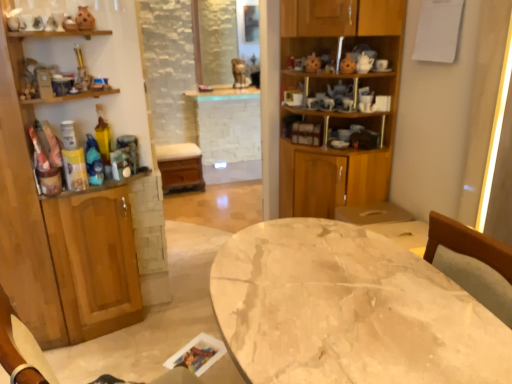
This screenshot has width=512, height=384. What do you see at coordinates (348, 310) in the screenshot? I see `marble table at center` at bounding box center [348, 310].

The height and width of the screenshot is (384, 512). In order to click on wooden cabinet at left, which is the 1th cabinetry in left-to-right order in this screenshot , I will do `click(75, 195)`.

Between wooden cabinet at left, which is the 2th cabinetry from right to left, and wooden cabinet at center, the 1th cabinetry when ordered from right to left, which one appears on the left side from the viewer's perspective?

wooden cabinet at left, which is the 2th cabinetry from right to left, is more to the left.

Is wooden cabinet at left, which is the 2th cabinetry from right to left, further to camera compared to wooden cabinet at center, which is counted as the second cabinetry, starting from the left?

No, wooden cabinet at left, which is the 2th cabinetry from right to left, is closer to the camera.

Could you tell me if wooden cabinet at left, which is the 2th cabinetry from right to left, is facing wooden cabinet at center, the 1th cabinetry when ordered from right to left?

No, wooden cabinet at left, which is the 2th cabinetry from right to left, is not aimed at wooden cabinet at center, the 1th cabinetry when ordered from right to left.

Is wooden cabinet at left, which is the 2th cabinetry from right to left, far away from wooden cabinet at center, which is counted as the second cabinetry, starting from the left?

That's right, there is a large distance between wooden cabinet at left, which is the 2th cabinetry from right to left, and wooden cabinet at center, which is counted as the second cabinetry, starting from the left.

Is wooden cabinet at center, the 1th cabinetry when ordered from right to left, closer to camera compared to marble table at center?

That is False.

Considering the sizes of wooden cabinet at center, which is counted as the second cabinetry, starting from the left, and marble table at center in the image, is wooden cabinet at center, which is counted as the second cabinetry, starting from the left, wider or thinner than marble table at center?

wooden cabinet at center, which is counted as the second cabinetry, starting from the left, is thinner than marble table at center.

From the image's perspective, relative to marble table at center, is wooden cabinet at center, the 1th cabinetry when ordered from right to left, above or below?

From the image's perspective, wooden cabinet at center, the 1th cabinetry when ordered from right to left, appears above marble table at center.

Is marble table at center at the back of wooden cabinet at center, which is counted as the second cabinetry, starting from the left?

No, wooden cabinet at center, which is counted as the second cabinetry, starting from the left, is not facing away from marble table at center.

At what (x,y) coordinates should I click in order to perform the action: click on table that is under the wooden cabinet at left, which is the 1th cabinetry in left-to-right order (from a real-world perspective). Please return your answer as a coordinate pair (x, y). The width and height of the screenshot is (512, 384). Looking at the image, I should click on (348, 310).

Is marble table at center taller or shorter than wooden cabinet at left, which is the 1th cabinetry in left-to-right order?

Considering their sizes, marble table at center has less height than wooden cabinet at left, which is the 1th cabinetry in left-to-right order.

From the image's perspective, between marble table at center and wooden cabinet at left, which is the 1th cabinetry in left-to-right order, which one is located above?

From the image's view, wooden cabinet at left, which is the 1th cabinetry in left-to-right order, is above.

Considering the sizes of marble table at center and wooden cabinet at left, which is the 2th cabinetry from right to left, in the image, is marble table at center wider or thinner than wooden cabinet at left, which is the 2th cabinetry from right to left,?

In the image, marble table at center appears to be wider than wooden cabinet at left, which is the 2th cabinetry from right to left.

From a real-world perspective, is wooden cabinet at center, the 1th cabinetry when ordered from right to left, on wooden cabinet at left, which is the 2th cabinetry from right to left?

Yes.

Looking at this image, can you confirm if wooden cabinet at center, the 1th cabinetry when ordered from right to left, is bigger than wooden cabinet at left, which is the 1th cabinetry in left-to-right order?

Yes.

Is wooden cabinet at center, the 1th cabinetry when ordered from right to left, placed right next to wooden cabinet at left, which is the 1th cabinetry in left-to-right order?

There is a gap between wooden cabinet at center, the 1th cabinetry when ordered from right to left, and wooden cabinet at left, which is the 1th cabinetry in left-to-right order.

Looking at this image, is wooden cabinet at center, which is counted as the second cabinetry, starting from the left, aimed at wooden cabinet at left, which is the 2th cabinetry from right to left?

No, wooden cabinet at center, which is counted as the second cabinetry, starting from the left, is not facing towards wooden cabinet at left, which is the 2th cabinetry from right to left.

Is wooden cabinet at left, which is the 1th cabinetry in left-to-right order, positioned far away from marble table at center?

Yes, wooden cabinet at left, which is the 1th cabinetry in left-to-right order, and marble table at center are quite far apart.

Is wooden cabinet at left, which is the 1th cabinetry in left-to-right order, positioned in front of marble table at center?

No, the depth of wooden cabinet at left, which is the 1th cabinetry in left-to-right order, is greater than that of marble table at center.

In the scene shown: In the image, is wooden cabinet at left, which is the 2th cabinetry from right to left, on the left side or the right side of marble table at center?

In the image, wooden cabinet at left, which is the 2th cabinetry from right to left, appears on the left side of marble table at center.

Which is less distant, (55, 103) or (329, 286)?

Point (55, 103) is farther from the camera than point (329, 286).

Is marble table at center not inside wooden cabinet at center, which is counted as the second cabinetry, starting from the left?

marble table at center lies outside wooden cabinet at center, which is counted as the second cabinetry, starting from the left,'s area.

Is marble table at center looking in the opposite direction of wooden cabinet at center, the 1th cabinetry when ordered from right to left?

marble table at center does not have its back to wooden cabinet at center, the 1th cabinetry when ordered from right to left.

Which is nearer, (275, 231) or (326, 111)?

The point (275, 231) is closer to the camera.

Based on their positions, is marble table at center located to the left or right of wooden cabinet at center, which is counted as the second cabinetry, starting from the left?

marble table at center is to the left of wooden cabinet at center, which is counted as the second cabinetry, starting from the left.

I want to click on cabinetry in front of the wooden cabinet at center, the 1th cabinetry when ordered from right to left, so click(75, 195).

Find the location of a particular element. Image resolution: width=512 pixels, height=384 pixels. the 2nd cabinetry behind the marble table at center is located at coordinates (338, 111).

Based on their spatial positions, is wooden cabinet at center, which is counted as the second cabinetry, starting from the left, or wooden cabinet at left, which is the 1th cabinetry in left-to-right order, further from marble table at center?

wooden cabinet at center, which is counted as the second cabinetry, starting from the left, lies further to marble table at center than the other object.

Which object lies further to the anchor point wooden cabinet at left, which is the 2th cabinetry from right to left, wooden cabinet at center, which is counted as the second cabinetry, starting from the left, or marble table at center?

Based on the image, marble table at center appears to be further to wooden cabinet at left, which is the 2th cabinetry from right to left.

When comparing their distances from wooden cabinet at center, the 1th cabinetry when ordered from right to left, does wooden cabinet at left, which is the 1th cabinetry in left-to-right order, or marble table at center seem further?

Among the two, marble table at center is located further to wooden cabinet at center, the 1th cabinetry when ordered from right to left.

Based on their spatial positions, is marble table at center or wooden cabinet at left, which is the 1th cabinetry in left-to-right order, further from wooden cabinet at center, which is counted as the second cabinetry, starting from the left?

marble table at center is further to wooden cabinet at center, which is counted as the second cabinetry, starting from the left.

Considering their positions, is wooden cabinet at left, which is the 1th cabinetry in left-to-right order, positioned further to marble table at center than wooden cabinet at center, the 1th cabinetry when ordered from right to left?

wooden cabinet at center, the 1th cabinetry when ordered from right to left, lies further to marble table at center than the other object.

Consider the image. Based on their spatial positions, is marble table at center or wooden cabinet at center, which is counted as the second cabinetry, starting from the left, further from wooden cabinet at left, which is the 1th cabinetry in left-to-right order?

Based on the image, marble table at center appears to be further to wooden cabinet at left, which is the 1th cabinetry in left-to-right order.

Where is `table between wooden cabinet at left, which is the 2th cabinetry from right to left, and wooden cabinet at center, which is counted as the second cabinetry, starting from the left, in the horizontal direction`? The height and width of the screenshot is (384, 512). table between wooden cabinet at left, which is the 2th cabinetry from right to left, and wooden cabinet at center, which is counted as the second cabinetry, starting from the left, in the horizontal direction is located at coordinates (348, 310).